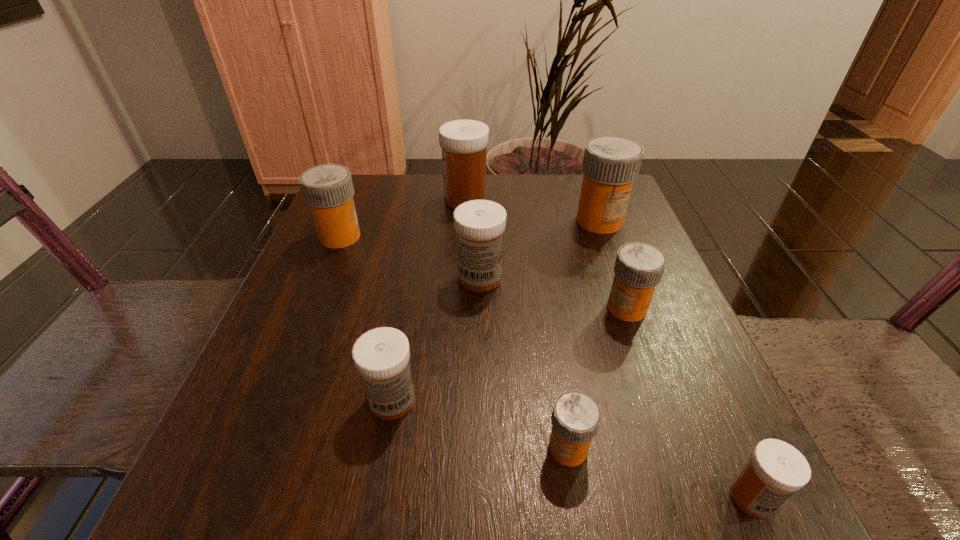
Where is `vacant space at the left edge of the desktop`? This screenshot has height=540, width=960. vacant space at the left edge of the desktop is located at coordinates (326, 320).

This screenshot has width=960, height=540. What are the coordinates of `free region at the right edge` in the screenshot? It's located at (698, 368).

In the image, there is a desktop. At what (x,y) coordinates should I click in order to perform the action: click on vacant area at the far left corner. Please return your answer as a coordinate pair (x, y). The height and width of the screenshot is (540, 960). Looking at the image, I should click on (372, 177).

The height and width of the screenshot is (540, 960). In the image, there is a desktop. Identify the location of vacant space at the far right corner. (575, 198).

Find the location of a particular element. The image size is (960, 540). empty space between the third smallest white medicine and the biggest orange medicine is located at coordinates (540, 249).

The image size is (960, 540). In order to click on free area in between the biggest white medicine and the second nearest orange medicine in this screenshot , I will do `click(546, 254)`.

The width and height of the screenshot is (960, 540). In order to click on free space between the nearest object and the third nearest white medicine in this screenshot , I will do `click(616, 387)`.

Identify the location of empty space between the farthest white medicine and the smallest white medicine. (609, 348).

What are the coordinates of `vacant point located between the third farthest orange medicine and the nearest object` in the screenshot? It's located at (689, 402).

Locate an element on the screen. free space between the seventh object from right to left and the second smallest orange medicine is located at coordinates 510,354.